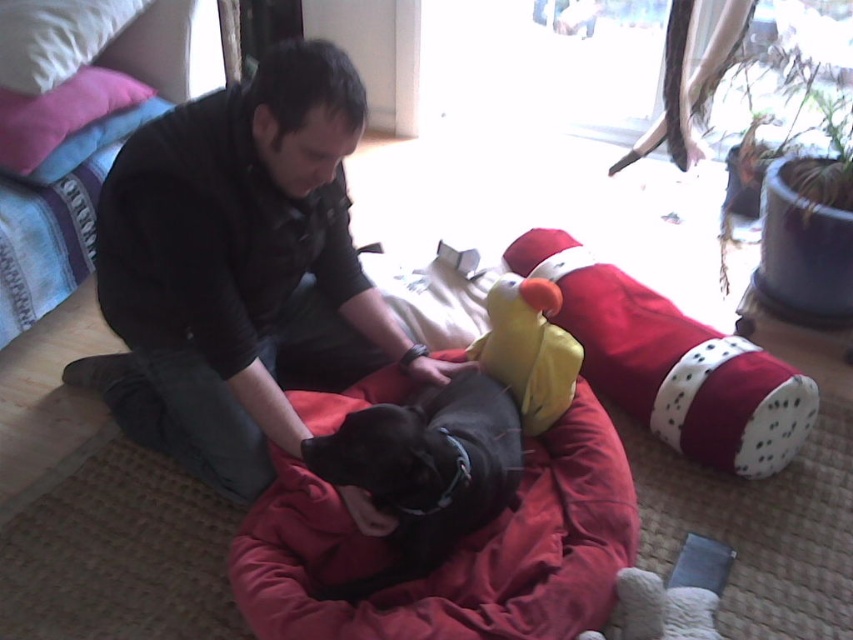
Question: In this image, where is brushed metal bed at upper left located relative to white soft pillow at upper left?

Choices:
 (A) above
 (B) below

Answer: (B)

Question: Does black smooth dog at center appear under white soft pillow at upper left?

Choices:
 (A) yes
 (B) no

Answer: (A)

Question: Which of the following is the closest to the observer?

Choices:
 (A) red fabric bean bag at lower center
 (B) black matte shirt at center
 (C) velvet-like red dog bed at center
 (D) white soft pillow at upper left

Answer: (B)

Question: Considering the real-world distances, which object is farthest from the velvet-like red dog bed at center?

Choices:
 (A) white soft pillow at upper left
 (B) red fabric bean bag at lower center
 (C) black matte shirt at center

Answer: (A)

Question: Can you confirm if black matte shirt at center is positioned below black smooth dog at center?

Choices:
 (A) yes
 (B) no

Answer: (B)

Question: Which of the following is the farthest from the observer?

Choices:
 (A) (492, 396)
 (B) (85, 35)

Answer: (B)